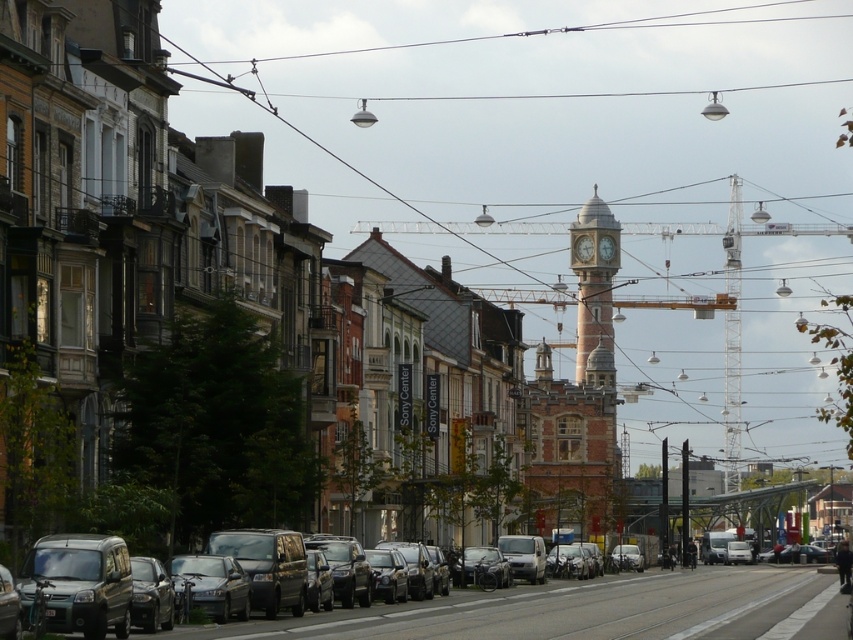
You are a pedestrian standing at the crosswalk. You see the metallic gray van at lower left and the black wire at upper center. Which object is closer to you?

The metallic gray van at lower left is closer to you because it is in front of the black wire at upper center.

You are standing on the street looking at the buildings and the clock tower. There are two points marked on the image, one at coordinate point [688,614] and another at point [599,26]. Which point is nearer to your eyes?

Point [688,614] is closer to the camera than point [599,26], so the point at [688,614] is nearer to your eyes.

In the scene shown: You are a delivery driver approaching the street scene and need to park your metallic gray van at lower left. There is a black wire at upper center. Can you safely park the van without hitting the wire?

The metallic gray van at lower left is below the black wire at upper center, so there is enough vertical space to park safely without hitting the wire.